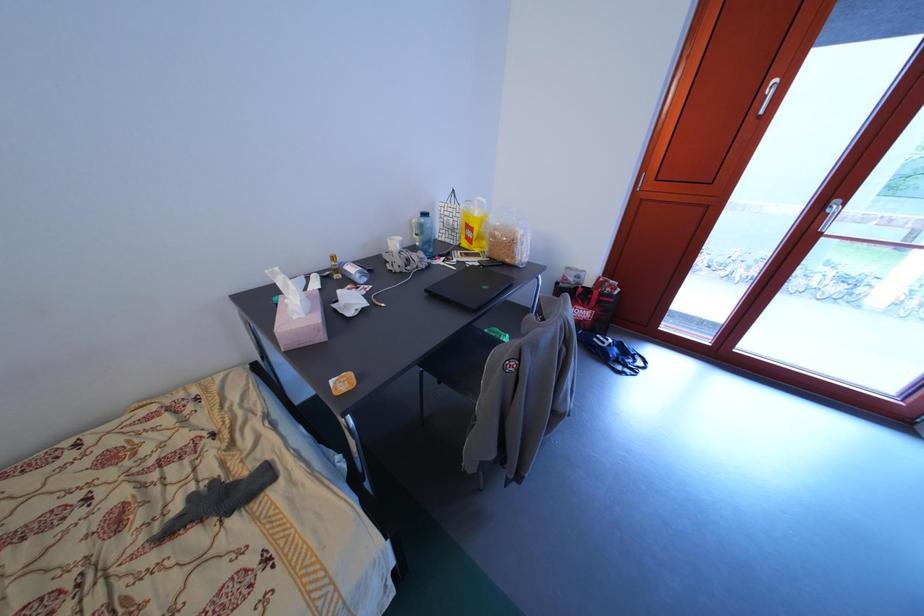
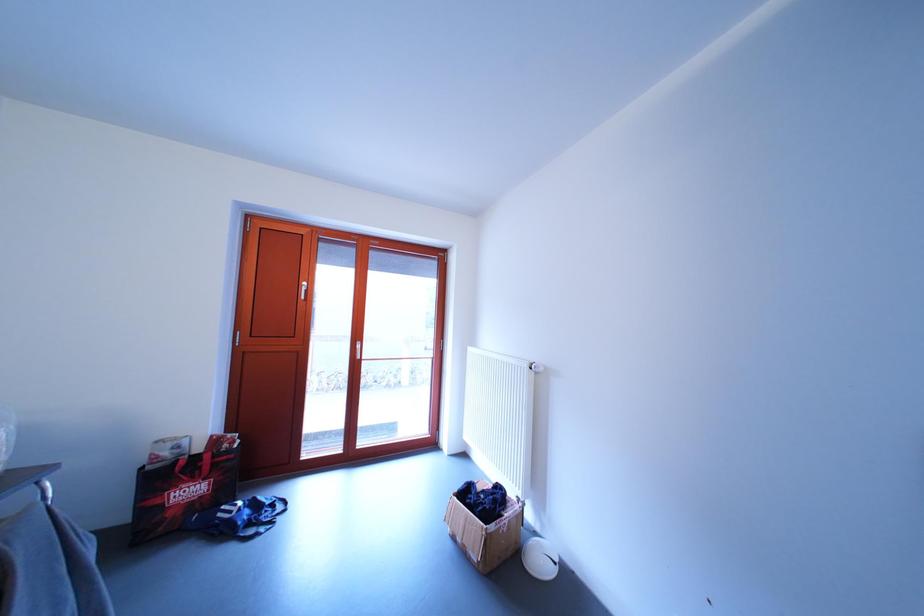
Question: The camera is either moving clockwise (left) or counter-clockwise (right) around the object. The first image is from the beginning of the video and the second image is from the end. Is the camera moving left or right when shooting the video?

Choices:
 (A) Left
 (B) Right

Answer: (A)